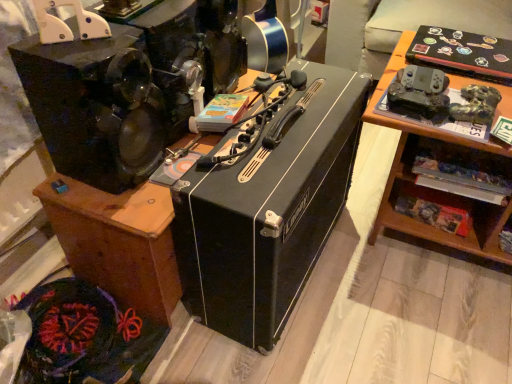
Question: Are black matte amplifier at center and black matte amplifier at center beside each other?

Choices:
 (A) yes
 (B) no

Answer: (B)

Question: Can you confirm if black matte amplifier at center is shorter than black matte amplifier at center?

Choices:
 (A) no
 (B) yes

Answer: (B)

Question: Can you confirm if black matte amplifier at center is wider than black matte amplifier at center?

Choices:
 (A) yes
 (B) no

Answer: (A)

Question: Is the position of black matte amplifier at center more distant than that of black matte amplifier at center?

Choices:
 (A) yes
 (B) no

Answer: (A)

Question: Is black matte amplifier at center completely or partially inside black matte amplifier at center?

Choices:
 (A) no
 (B) yes

Answer: (A)

Question: Is black matte amplifier at center not near black matte amplifier at center?

Choices:
 (A) no
 (B) yes

Answer: (A)

Question: Is black matte amplifier at center outside of black matte amplifier at center?

Choices:
 (A) no
 (B) yes

Answer: (B)

Question: Is black matte amplifier at center oriented towards black matte amplifier at center?

Choices:
 (A) yes
 (B) no

Answer: (A)

Question: From a real-world perspective, is black matte amplifier at center located beneath black matte amplifier at center?

Choices:
 (A) no
 (B) yes

Answer: (A)

Question: Can you confirm if black matte amplifier at center is smaller than black matte amplifier at center?

Choices:
 (A) yes
 (B) no

Answer: (A)

Question: Is there a large distance between black matte amplifier at center and black matte amplifier at center?

Choices:
 (A) yes
 (B) no

Answer: (B)

Question: Is black matte amplifier at center shorter than black matte amplifier at center?

Choices:
 (A) yes
 (B) no

Answer: (B)

Question: From the image's perspective, is black matte amplifier at center positioned above or below black matte amplifier at center?

Choices:
 (A) below
 (B) above

Answer: (A)